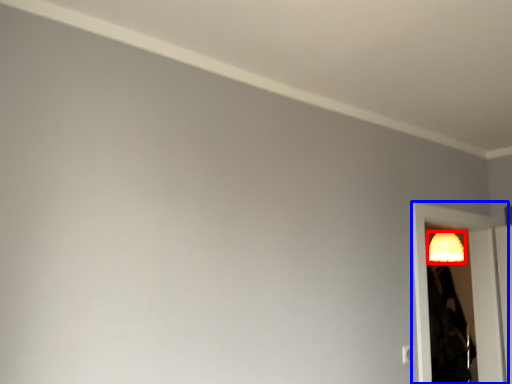
Question: Which object is closer to the camera taking this photo, lamp (highlighted by a red box) or screen door (highlighted by a blue box)?

Choices:
 (A) lamp
 (B) screen door

Answer: (B)